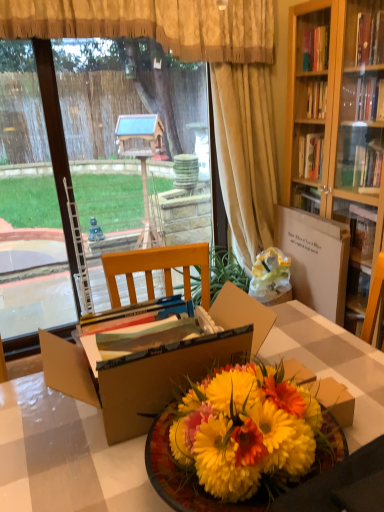
I want to click on beige fabric curtain at center, which is counted as the 1th curtain, starting from the right, so click(245, 154).

This screenshot has height=512, width=384. Describe the element at coordinates (60, 185) in the screenshot. I see `transparent glass window screen at left` at that location.

In order to face vibrant yellow petals at center, should I rotate leftwards or rightwards?

To align with it, rotate right about 18.429°.

What is the approximate height of gold textured curtain at upper center, the 2th curtain in the right-to-left sequence?

It is 15.55 inches.

What is the approximate width of white cardboard box at center-right?

white cardboard box at center-right is 11.22 centimeters in width.

Where is `white cardboard box at center-right`? The height and width of the screenshot is (512, 384). white cardboard box at center-right is located at coordinates (315, 259).

I want to click on beige fabric curtain at center, which is counted as the 1th curtain, starting from the right, so click(x=245, y=154).

How many degrees apart are the facing directions of wooden table at center and beige fabric curtain at center, the second curtain from the left?

The facing directions of wooden table at center and beige fabric curtain at center, the second curtain from the left, are 176 degrees apart.

Which of these two, wooden table at center or beige fabric curtain at center, the second curtain from the left, stands taller?

With more height is beige fabric curtain at center, the second curtain from the left.

Which is more to the left, wooden table at center or beige fabric curtain at center, which is counted as the 1th curtain, starting from the right?

From the viewer's perspective, wooden table at center appears more on the left side.

Which of these two, wooden table at center or beige fabric curtain at center, the second curtain from the left, is thinner?

Thinner between the two is beige fabric curtain at center, the second curtain from the left.

From a real-world perspective, is transparent glass window screen at left physically located above or below cardboard box at center?

Clearly, from a real-world perspective, transparent glass window screen at left is above cardboard box at center.

Is transparent glass window screen at left not near cardboard box at center?

Yes.

Which point is more distant from viewer, (126, 98) or (225, 362)?

Positioned behind is point (126, 98).

From the image's perspective, would you say beige fabric curtain at center, the second curtain from the left, is shown under transparent glass window screen at left?

No.

Can you confirm if beige fabric curtain at center, which is counted as the 1th curtain, starting from the right, is wider than transparent glass window screen at left?

Yes, beige fabric curtain at center, which is counted as the 1th curtain, starting from the right, is wider than transparent glass window screen at left.

Can you tell me how much beige fabric curtain at center, the second curtain from the left, and transparent glass window screen at left differ in facing direction?

2.76 degrees.

How much distance is there between beige fabric curtain at center, the second curtain from the left, and transparent glass window screen at left?

beige fabric curtain at center, the second curtain from the left, and transparent glass window screen at left are 9.70 feet apart.

From a real-world perspective, relative to white cardboard box at center-right, is gold textured curtain at upper center, which is counted as the first curtain, starting from the left, vertically above or below?

gold textured curtain at upper center, which is counted as the first curtain, starting from the left, is situated higher than white cardboard box at center-right in the real world.

Locate an element on the screen. The width and height of the screenshot is (384, 512). the 2nd curtain in front of the white cardboard box at center-right is located at coordinates (153, 25).

Is gold textured curtain at upper center, the 2th curtain in the right-to-left sequence, touching white cardboard box at center-right?

gold textured curtain at upper center, the 2th curtain in the right-to-left sequence, and white cardboard box at center-right are clearly separated.

Is the depth of gold textured curtain at upper center, the 2th curtain in the right-to-left sequence, greater than that of white cardboard box at center-right?

That is False.

This screenshot has width=384, height=512. What are the coordinates of `desk directly beneath the white cardboard box at center-right (from a real-world perspective)` in the screenshot? It's located at (65, 455).

Would you say wooden table at center is a long distance from white cardboard box at center-right?

No, wooden table at center is in close proximity to white cardboard box at center-right.

In the scene shown: Which object is further away from the camera, wooden table at center or white cardboard box at center-right?

white cardboard box at center-right is behind.

Between wooden table at center and white cardboard box at center-right, which one has smaller size?

white cardboard box at center-right is smaller.

Can you tell me how much white cardboard box at center-right and beige fabric curtain at center, the second curtain from the left, differ in facing direction?

white cardboard box at center-right and beige fabric curtain at center, the second curtain from the left, are facing 86.2 degrees away from each other.

Considering the relative positions of white cardboard box at center-right and beige fabric curtain at center, the second curtain from the left, in the image provided, is white cardboard box at center-right to the right of beige fabric curtain at center, the second curtain from the left, from the viewer's perspective?

Indeed, white cardboard box at center-right is positioned on the right side of beige fabric curtain at center, the second curtain from the left.

From the image's perspective, who appears lower, white cardboard box at center-right or beige fabric curtain at center, which is counted as the 1th curtain, starting from the right?

white cardboard box at center-right.

Between white cardboard box at center-right and beige fabric curtain at center, which is counted as the 1th curtain, starting from the right, which one has less height?

white cardboard box at center-right.

Looking at this image, is there a large distance between vibrant yellow petals at center and beige fabric curtain at center, which is counted as the 1th curtain, starting from the right?

vibrant yellow petals at center is far away from beige fabric curtain at center, which is counted as the 1th curtain, starting from the right.

Measure the distance between vibrant yellow petals at center and beige fabric curtain at center, which is counted as the 1th curtain, starting from the right.

6.55 feet.

Would you say vibrant yellow petals at center is to the left or to the right of beige fabric curtain at center, the second curtain from the left, in the picture?

vibrant yellow petals at center is positioned on beige fabric curtain at center, the second curtain from the left,'s left side.

From the image's perspective, relative to beige fabric curtain at center, which is counted as the 1th curtain, starting from the right, is vibrant yellow petals at center above or below?

Clearly, from the image's perspective, vibrant yellow petals at center is below beige fabric curtain at center, which is counted as the 1th curtain, starting from the right.

Find the location of a particular element. curtain that is the 1st object above the wooden table at center (from a real-world perspective) is located at coordinates (245, 154).

Where is `box below the transparent glass window screen at left (from the image's perspective)`? The width and height of the screenshot is (384, 512). box below the transparent glass window screen at left (from the image's perspective) is located at coordinates (156, 366).

Based on their spatial positions, is gold textured curtain at upper center, which is counted as the first curtain, starting from the left, or white cardboard box at center-right closer to transparent glass window screen at left?

Among the two, white cardboard box at center-right is located nearer to transparent glass window screen at left.

When comparing their distances from beige fabric curtain at center, which is counted as the 1th curtain, starting from the right, does white cardboard box at center-right or wooden table at center seem closer?

white cardboard box at center-right lies closer to beige fabric curtain at center, which is counted as the 1th curtain, starting from the right, than the other object.

Looking at the image, which one is located closer to gold textured curtain at upper center, the 2th curtain in the right-to-left sequence, transparent glass window screen at left or vibrant yellow petals at center?

The object closer to gold textured curtain at upper center, the 2th curtain in the right-to-left sequence, is vibrant yellow petals at center.

Based on their spatial positions, is gold textured curtain at upper center, the 2th curtain in the right-to-left sequence, or white cardboard box at center-right closer to wooden table at center?

Among the two, white cardboard box at center-right is located nearer to wooden table at center.

Looking at the image, which one is located further to transparent glass window screen at left, white cardboard box at center-right or wooden table at center?

Among the two, wooden table at center is located further to transparent glass window screen at left.

From the image, which object appears to be nearer to wooden table at center, gold textured curtain at upper center, the 2th curtain in the right-to-left sequence, or transparent glass window screen at left?

gold textured curtain at upper center, the 2th curtain in the right-to-left sequence.

Which object lies nearer to the anchor point gold textured curtain at upper center, the 2th curtain in the right-to-left sequence, white cardboard box at center-right or transparent glass window screen at left?

The object closer to gold textured curtain at upper center, the 2th curtain in the right-to-left sequence, is white cardboard box at center-right.

Which object lies nearer to the anchor point cardboard box at center, white cardboard box at center-right or transparent glass window screen at left?

white cardboard box at center-right lies closer to cardboard box at center than the other object.

You are a GUI agent. You are given a task and a screenshot of the screen. Output one action in this format:
    pyautogui.click(x=<x>, y=<y>)
    Task: Click on the window screen between vibrant yellow petals at center and beige fabric curtain at center, which is counted as the 1th curtain, starting from the right, along the z-axis
    The height and width of the screenshot is (512, 384).
    Given the screenshot: What is the action you would take?
    pos(60,185)

In order to click on box between gold textured curtain at upper center, which is counted as the first curtain, starting from the left, and vibrant yellow petals at center vertically in this screenshot , I will do `click(156, 366)`.

This screenshot has height=512, width=384. Identify the location of window screen located between gold textured curtain at upper center, which is counted as the first curtain, starting from the left, and beige fabric curtain at center, the second curtain from the left, in the left-right direction. (60, 185).

The height and width of the screenshot is (512, 384). What are the coordinates of `curtain between vibrant yellow petals at center and beige fabric curtain at center, the second curtain from the left, from front to back` in the screenshot? It's located at (153, 25).